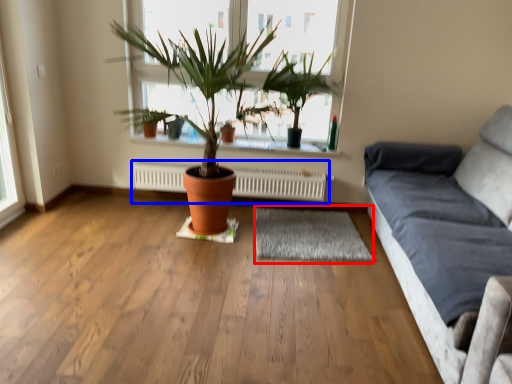
Question: Which point is further to the camera, mat (highlighted by a red box) or heater (highlighted by a blue box)?

Choices:
 (A) mat
 (B) heater

Answer: (B)